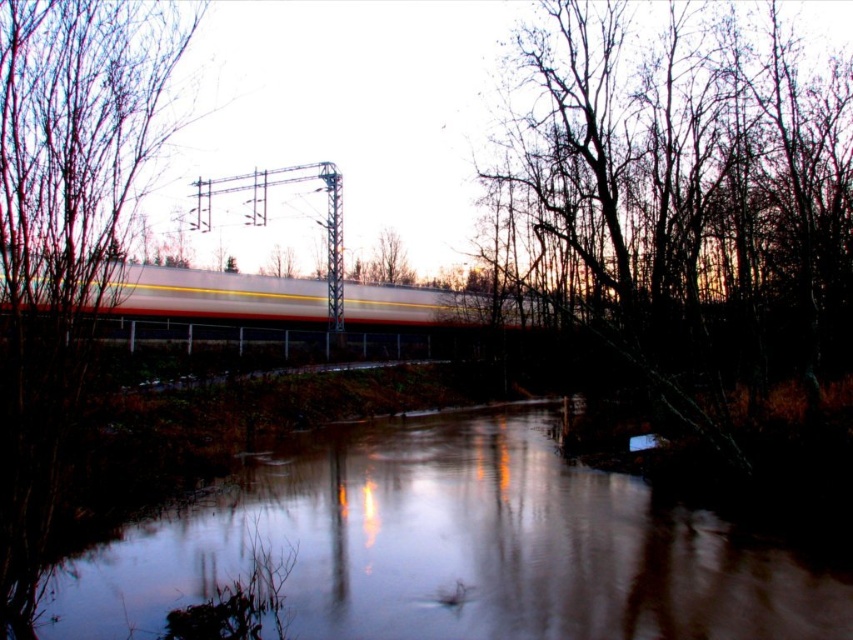
Which is more to the left, smooth reflective water at center or dark brown bark tree at right?

From the viewer's perspective, smooth reflective water at center appears more on the left side.

How distant is smooth reflective water at center from dark brown bark tree at right?

They are 19.53 feet apart.

You are a GUI agent. You are given a task and a screenshot of the screen. Output one action in this format:
    pyautogui.click(x=<x>, y=<y>)
    Task: Click on the smooth reflective water at center
    The width and height of the screenshot is (853, 640).
    Given the screenshot: What is the action you would take?
    pyautogui.click(x=450, y=548)